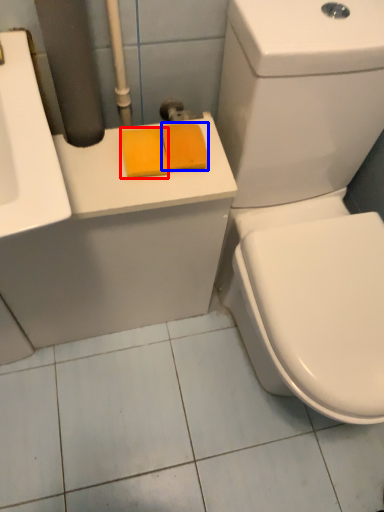
Question: Which object is closer to the camera taking this photo, soap (highlighted by a red box) or soap (highlighted by a blue box)?

Choices:
 (A) soap
 (B) soap

Answer: (A)